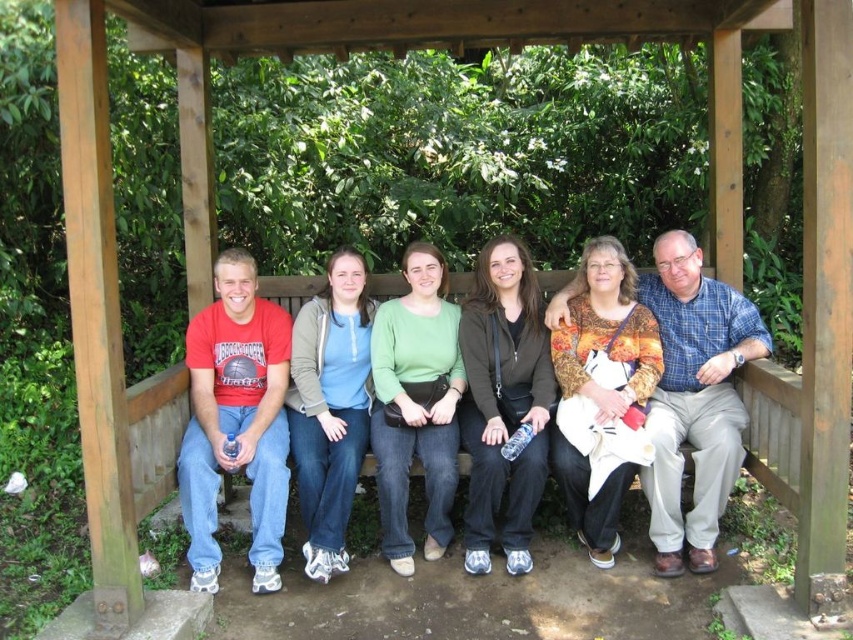
Question: Among these points, which one is nearest to the camera?

Choices:
 (A) (427, 545)
 (B) (595, 316)
 (C) (463, 364)
 (D) (207, 368)

Answer: (A)

Question: Is matte brown jacket at center positioned at the back of green matte sweater at center?

Choices:
 (A) yes
 (B) no

Answer: (B)

Question: Which object is the closest to the printed fabric blouse at center?

Choices:
 (A) green matte sweater at center
 (B) matte black bench at center
 (C) matte red t-shirt at left

Answer: (B)

Question: Is printed fabric blouse at center above green matte sweater at center?

Choices:
 (A) no
 (B) yes

Answer: (B)

Question: Where is printed fabric blouse at center located in relation to light blue cotton shirt at center in the image?

Choices:
 (A) below
 (B) above

Answer: (B)

Question: Which of the following is the closest to the observer?

Choices:
 (A) (376, 484)
 (B) (323, 404)
 (C) (276, 548)
 (D) (672, 257)

Answer: (C)